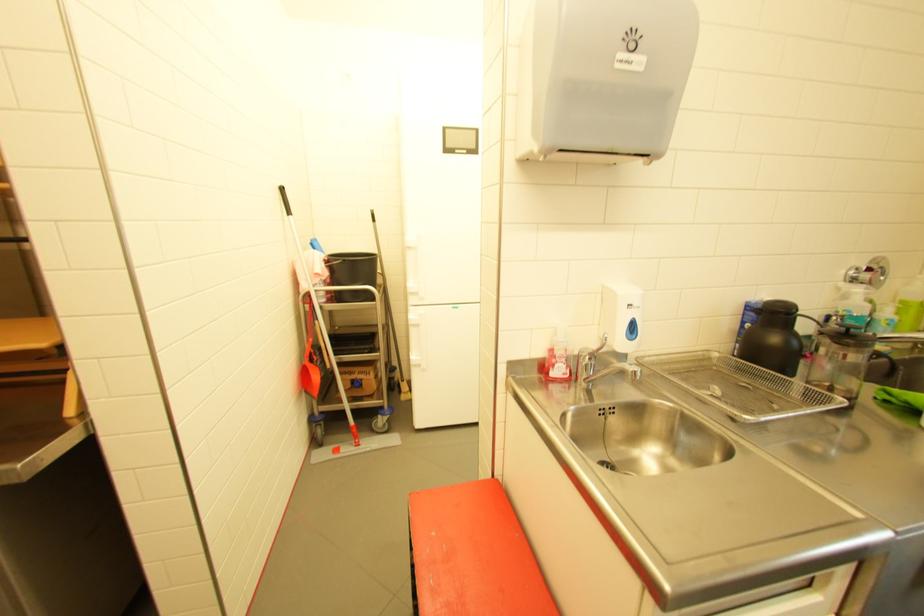
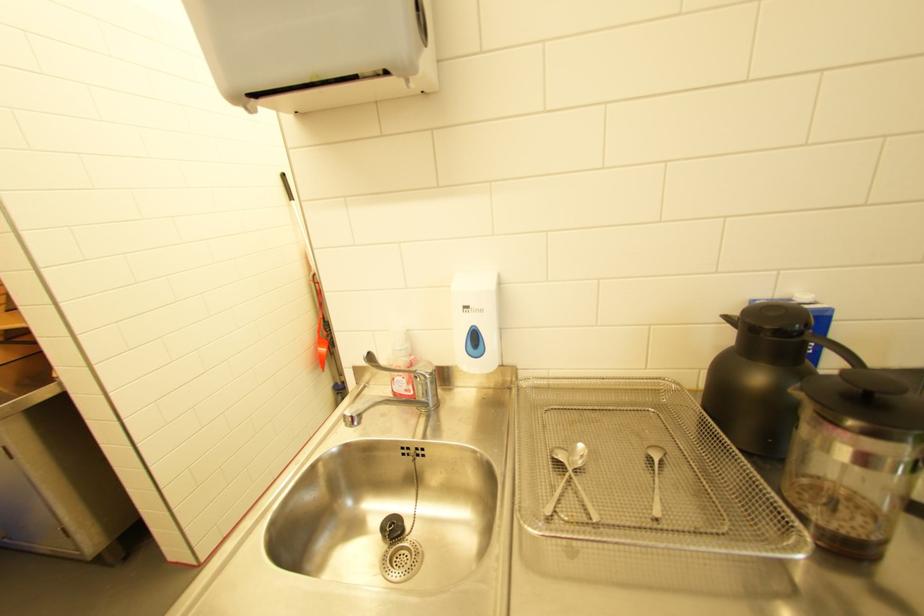
Find the pixel in the second image that matches (x=760, y=302) in the first image.

(767, 302)